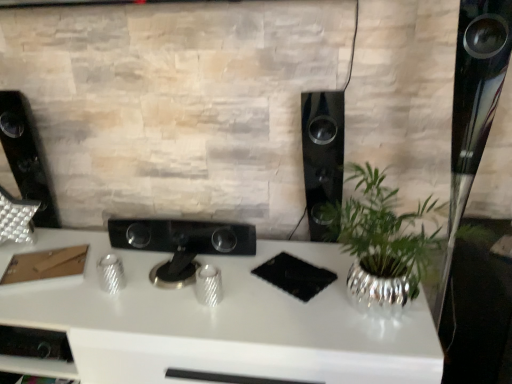
Question: Is black glossy speaker at center-right, the second speaker positioned from the left, to the left or to the right of black glossy controller at center in the image?

Choices:
 (A) left
 (B) right

Answer: (B)

Question: Considering their positions, is black glossy speaker at center-right, the second speaker positioned from the left, located in front of or behind black glossy controller at center?

Choices:
 (A) behind
 (B) front

Answer: (B)

Question: Which object is the farthest from the white glossy desk at center?

Choices:
 (A) black glossy speaker at left, which ranks as the 2th speaker in right-to-left order
 (B) black glossy speaker at center-right, placed as the first speaker when sorted from right to left
 (C) black glossy controller at center

Answer: (A)

Question: Based on their relative distances, which object is nearer to the black glossy speaker at center-right, placed as the first speaker when sorted from right to left?

Choices:
 (A) black glossy speaker at left, which is the 1th speaker in left-to-right order
 (B) black glossy controller at center
 (C) white glossy desk at center

Answer: (B)